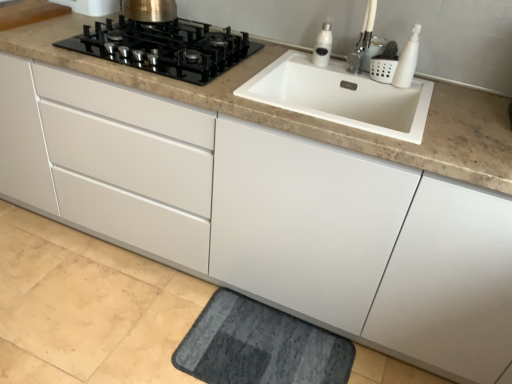
Question: Is white matte soap dispenser at upper right, which is counted as the 2th soap dispenser, starting from the left, next to dark gray textured bath mat at lower center and touching it?

Choices:
 (A) yes
 (B) no

Answer: (B)

Question: From the image's perspective, does white matte soap dispenser at upper right, which is the 1th soap dispenser from front to back, appear lower than dark gray textured bath mat at lower center?

Choices:
 (A) no
 (B) yes

Answer: (A)

Question: From a real-world perspective, does white matte soap dispenser at upper right, which is the 1th soap dispenser from front to back, sit lower than dark gray textured bath mat at lower center?

Choices:
 (A) no
 (B) yes

Answer: (A)

Question: Does white matte soap dispenser at upper right, which is counted as the 2th soap dispenser, starting from the left, have a lesser width compared to dark gray textured bath mat at lower center?

Choices:
 (A) yes
 (B) no

Answer: (A)

Question: Is white matte soap dispenser at upper right, which is counted as the 1th soap dispenser, starting from the right, completely or partially outside of dark gray textured bath mat at lower center?

Choices:
 (A) no
 (B) yes

Answer: (B)

Question: Considering the relative positions of white matte soap dispenser at upper right, the 2th soap dispenser when ordered from back to front, and dark gray textured bath mat at lower center in the image provided, is white matte soap dispenser at upper right, the 2th soap dispenser when ordered from back to front, to the left of dark gray textured bath mat at lower center from the viewer's perspective?

Choices:
 (A) no
 (B) yes

Answer: (A)

Question: Is black glass gas stove at upper left completely or partially outside of white glossy soap dispenser at upper right, the 1th soap dispenser positioned from the left?

Choices:
 (A) no
 (B) yes

Answer: (B)

Question: Can you confirm if black glass gas stove at upper left is bigger than white glossy soap dispenser at upper right, which appears as the 2th soap dispenser when viewed from the front?

Choices:
 (A) yes
 (B) no

Answer: (A)

Question: From a real-world perspective, is black glass gas stove at upper left under white glossy soap dispenser at upper right, which appears as the 2th soap dispenser when viewed from the front?

Choices:
 (A) no
 (B) yes

Answer: (B)

Question: Could you tell me if black glass gas stove at upper left is facing white glossy soap dispenser at upper right, the 1th soap dispenser positioned from the back?

Choices:
 (A) yes
 (B) no

Answer: (B)

Question: Is black glass gas stove at upper left placed right next to white glossy soap dispenser at upper right, the 1th soap dispenser positioned from the left?

Choices:
 (A) yes
 (B) no

Answer: (B)

Question: Can you confirm if black glass gas stove at upper left is wider than white glossy soap dispenser at upper right, the 1th soap dispenser positioned from the back?

Choices:
 (A) yes
 (B) no

Answer: (A)

Question: Is white matte soap dispenser at upper right, which is the 1th soap dispenser from front to back, further to the viewer compared to white ceramic faucet at upper right?

Choices:
 (A) no
 (B) yes

Answer: (B)